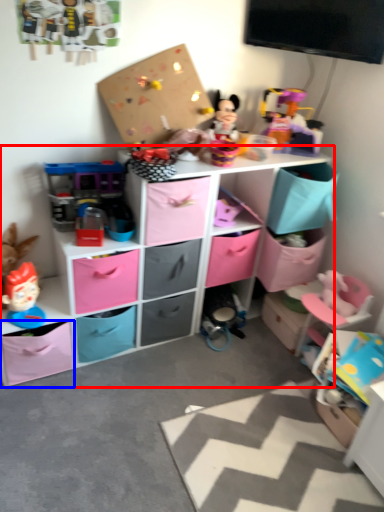
Question: Which of the following is the farthest to the observer, shelf (highlighted by a red box) or storage box (highlighted by a blue box)?

Choices:
 (A) shelf
 (B) storage box

Answer: (B)